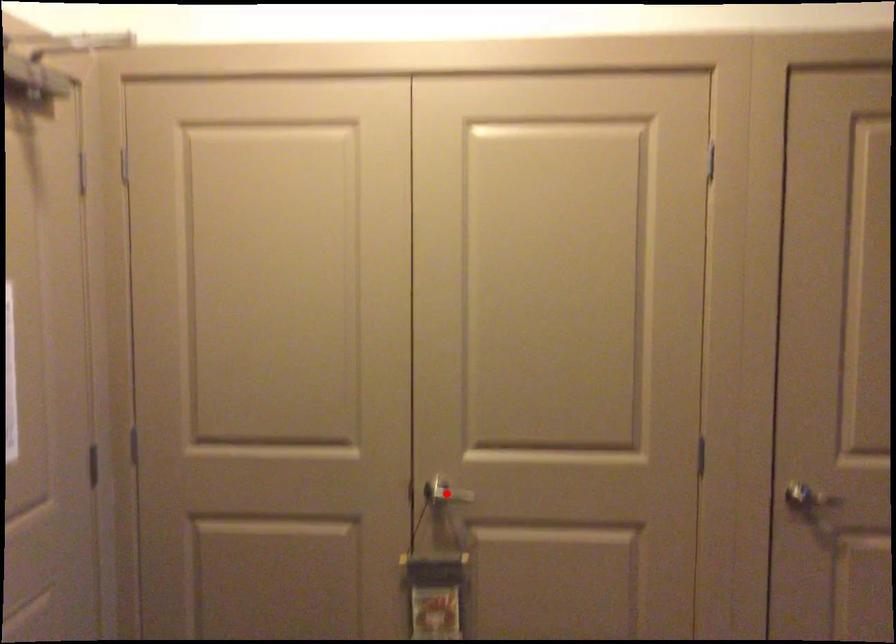
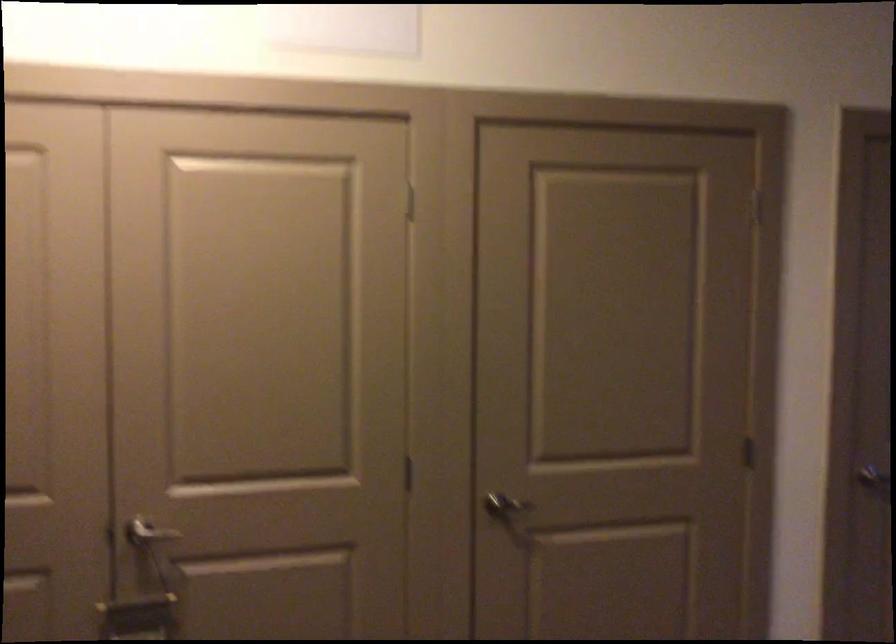
Find the pixel in the second image that matches the highlighted location in the first image.

(148, 535)